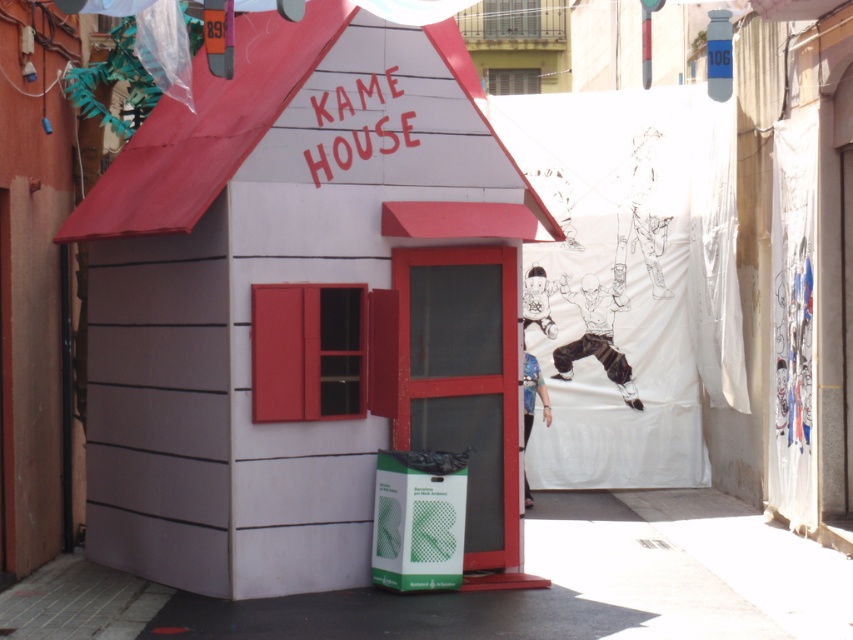
You are standing in front of the scene and want to enter the building closest to you. Which one should you approach, the matte white house at center or the white matte hut at center?

The matte white house at center is in front of the white matte hut at center, so you should approach the matte white house at center to enter the closest building.

You are a delivery person trying to place a package between the matte white house at center and the white matte hut at center. The package requires 1.6 meters of space to be safely placed. Is there enough space between them?

The matte white house at center and the white matte hut at center are 1.59 meters apart. Since the required space is 1.6 meters, there is not enough space to safely place the package between them.